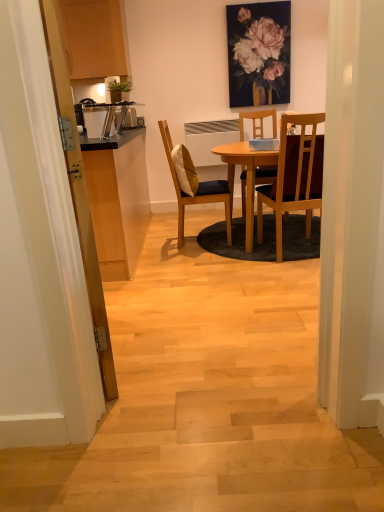
Question: Is yellow fabric pillow at center completely or partially outside of wooden chair at center, arranged as the first chair when viewed from the right?

Choices:
 (A) no
 (B) yes

Answer: (B)

Question: Can wooden chair at center, arranged as the first chair when viewed from the right, be found inside yellow fabric pillow at center?

Choices:
 (A) yes
 (B) no

Answer: (B)

Question: Is yellow fabric pillow at center to the right of wooden chair at center, the second chair from the left, from the viewer's perspective?

Choices:
 (A) no
 (B) yes

Answer: (A)

Question: Does yellow fabric pillow at center have a larger size compared to wooden chair at center, the second chair from the left?

Choices:
 (A) no
 (B) yes

Answer: (A)

Question: Is yellow fabric pillow at center turned away from wooden chair at center, arranged as the first chair when viewed from the right?

Choices:
 (A) yes
 (B) no

Answer: (B)

Question: Considering the relative sizes of yellow fabric pillow at center and wooden chair at center, the second chair from the left, in the image provided, is yellow fabric pillow at center smaller than wooden chair at center, the second chair from the left,?

Choices:
 (A) no
 (B) yes

Answer: (B)

Question: Could wooden chair with cushion at center, the second chair in the right-to-left sequence, be considered to be inside yellow fabric pillow at center?

Choices:
 (A) yes
 (B) no

Answer: (B)

Question: Is yellow fabric pillow at center facing towards wooden chair with cushion at center, the first chair from the left?

Choices:
 (A) no
 (B) yes

Answer: (B)

Question: Can you see yellow fabric pillow at center touching wooden chair with cushion at center, the second chair in the right-to-left sequence?

Choices:
 (A) no
 (B) yes

Answer: (A)

Question: Considering the relative sizes of yellow fabric pillow at center and wooden chair with cushion at center, the second chair in the right-to-left sequence, in the image provided, is yellow fabric pillow at center bigger than wooden chair with cushion at center, the second chair in the right-to-left sequence,?

Choices:
 (A) yes
 (B) no

Answer: (B)

Question: Considering the relative positions of yellow fabric pillow at center and wooden chair with cushion at center, the second chair in the right-to-left sequence, in the image provided, is yellow fabric pillow at center in front of wooden chair with cushion at center, the second chair in the right-to-left sequence,?

Choices:
 (A) yes
 (B) no

Answer: (B)

Question: Is yellow fabric pillow at center positioned behind wooden chair with cushion at center, the first chair from the left?

Choices:
 (A) no
 (B) yes

Answer: (B)

Question: Can you confirm if transparent wooden door at left is positioned to the right of yellow fabric pillow at center?

Choices:
 (A) yes
 (B) no

Answer: (B)